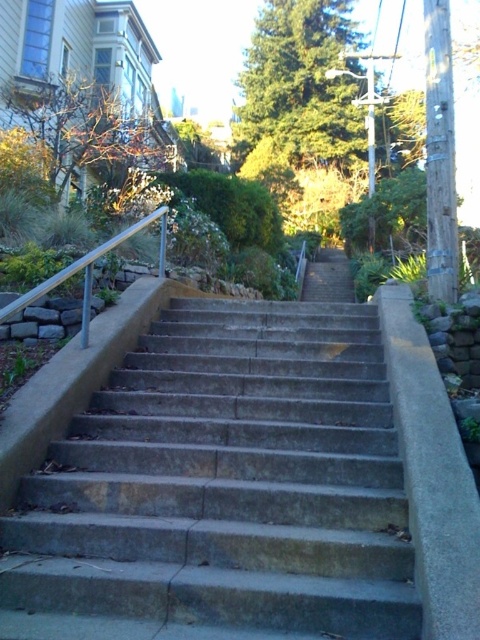
Question: Is concrete stairs at center further to the viewer compared to satin silver railing at left?

Choices:
 (A) no
 (B) yes

Answer: (A)

Question: Which point is closer to the camera?

Choices:
 (A) pos(206,378)
 (B) pos(158,216)

Answer: (A)

Question: Is concrete stairs at center to the right of satin silver railing at left from the viewer's perspective?

Choices:
 (A) no
 (B) yes

Answer: (B)

Question: Among these objects, which one is farthest from the camera?

Choices:
 (A) satin silver railing at left
 (B) concrete stairs at center

Answer: (A)

Question: Is concrete stairs at center below satin silver railing at left?

Choices:
 (A) no
 (B) yes

Answer: (B)